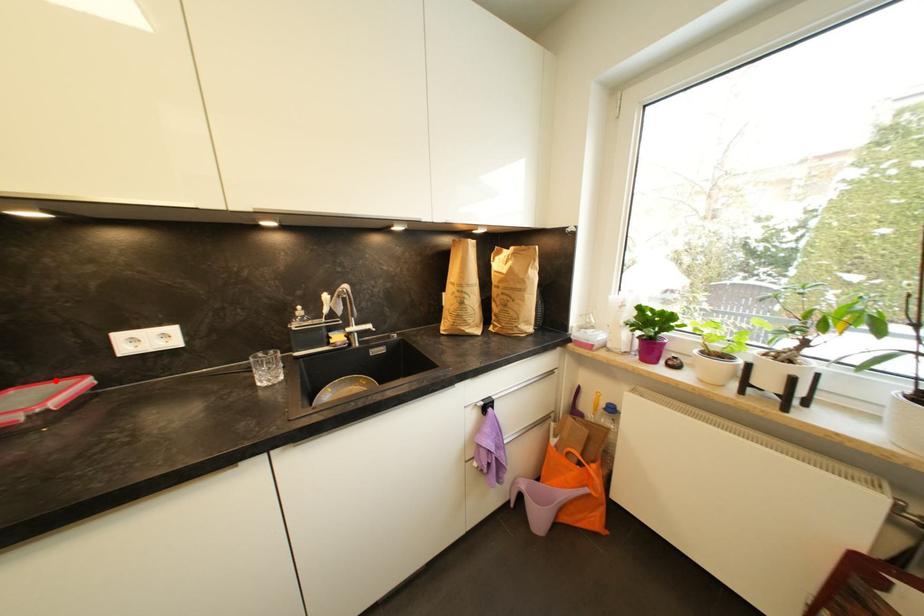
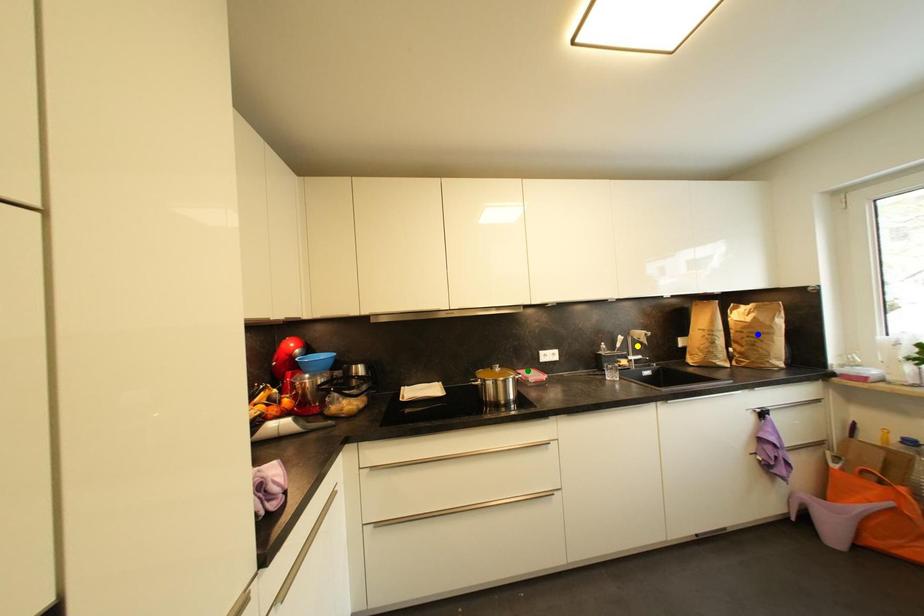
Question: I am providing you with two images of the same scene from different viewpoints. A red point is marked on the first image. You are given multiple points on the second image. Which mark in image 2 goes with the point in image 1?

Choices:
 (A) blue point
 (B) green point
 (C) yellow point

Answer: (B)